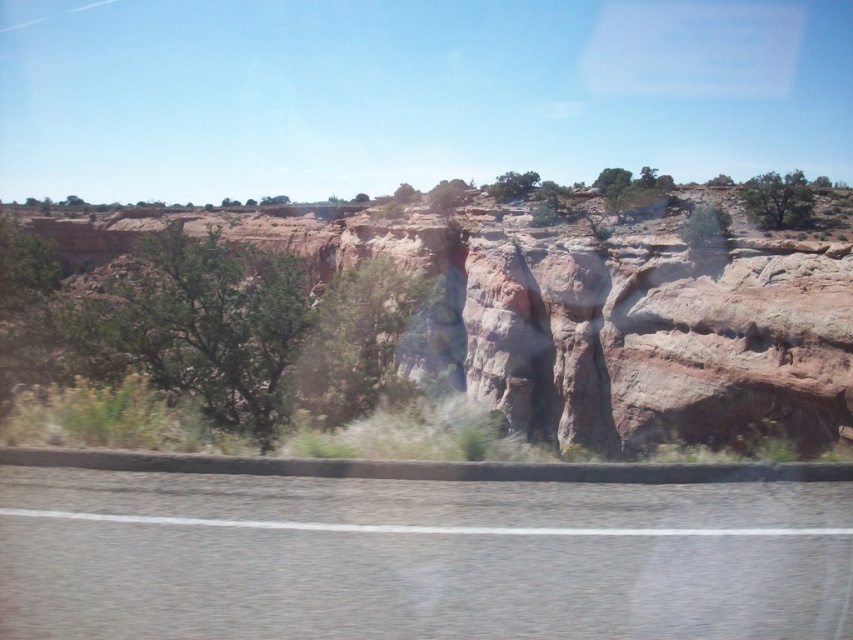
Looking at this image, you are a driver navigating a desert highway and see the point marked at coordinates (418, 557). What does this point represent?

The point marked at coordinates (418, 557) represents the gray asphalt highway at lower center.

You are driving on the gray asphalt highway at lower center and want to reach the rustic stone cliff at center. Based on their sizes, which one would you need to look up to see more?

The rustic stone cliff at center is taller than the gray asphalt highway at lower center, so you would need to look up more to see the rustic stone cliff at center.